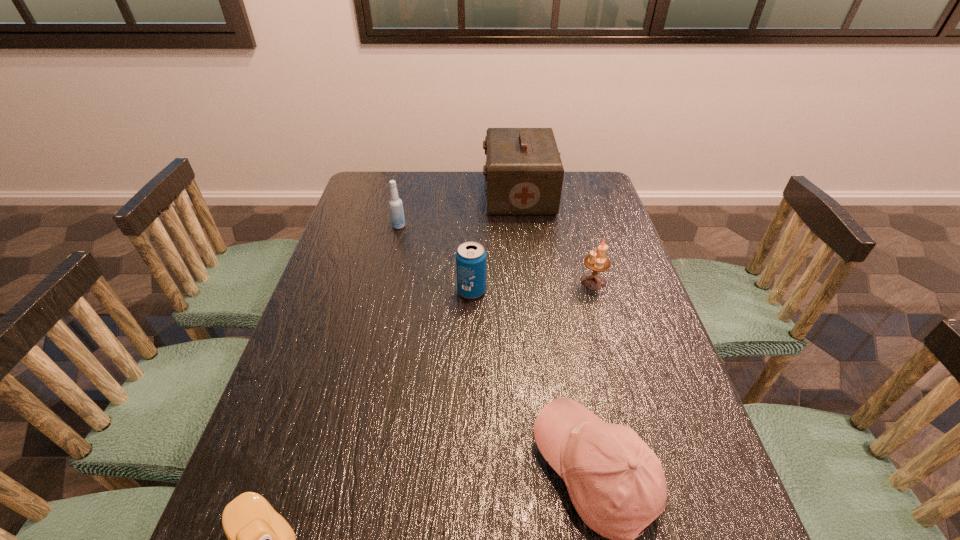
Where is `object that is positioned at the far edge`? Image resolution: width=960 pixels, height=540 pixels. object that is positioned at the far edge is located at coordinates (524, 174).

Identify the location of object that is positioned at the right edge. (597, 262).

You are a GUI agent. You are given a task and a screenshot of the screen. Output one action in this format:
    pyautogui.click(x=<x>, y=<y>)
    Task: Click on the free space at the far edge
    
    Given the screenshot: What is the action you would take?
    pyautogui.click(x=458, y=177)

In the image, there is a desktop. At what (x,y) coordinates should I click in order to perform the action: click on free space at the left edge. Please return your answer as a coordinate pair (x, y). Image resolution: width=960 pixels, height=540 pixels. Looking at the image, I should click on (331, 448).

In the image, there is a desktop. Identify the location of vacant space at the right edge. (627, 258).

Find the location of `vacant space at the far right corner`. vacant space at the far right corner is located at coordinates (583, 195).

Locate an element on the screen. The width and height of the screenshot is (960, 540). vacant area between the fifth nearest object and the soda can is located at coordinates coord(435,259).

Where is `free space between the first-aid kit and the candle holder`? Image resolution: width=960 pixels, height=540 pixels. free space between the first-aid kit and the candle holder is located at coordinates (556, 237).

Find the location of `free spot between the soda can and the candle holder`. free spot between the soda can and the candle holder is located at coordinates (533, 286).

At what (x,y) coordinates should I click in order to perform the action: click on free space between the candle holder and the first-aid kit. Please return your answer as a coordinate pair (x, y). The image size is (960, 540). Looking at the image, I should click on (556, 237).